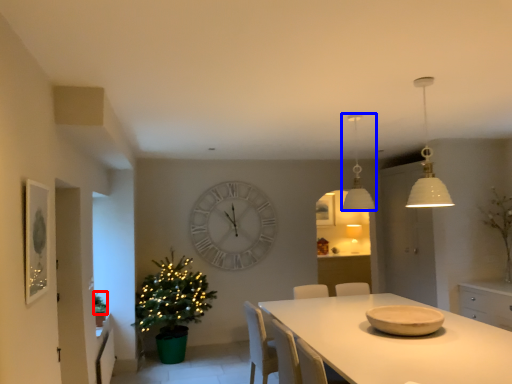
Question: Which of the following is the closest to the observer, plant (highlighted by a red box) or lamp (highlighted by a blue box)?

Choices:
 (A) plant
 (B) lamp

Answer: (B)